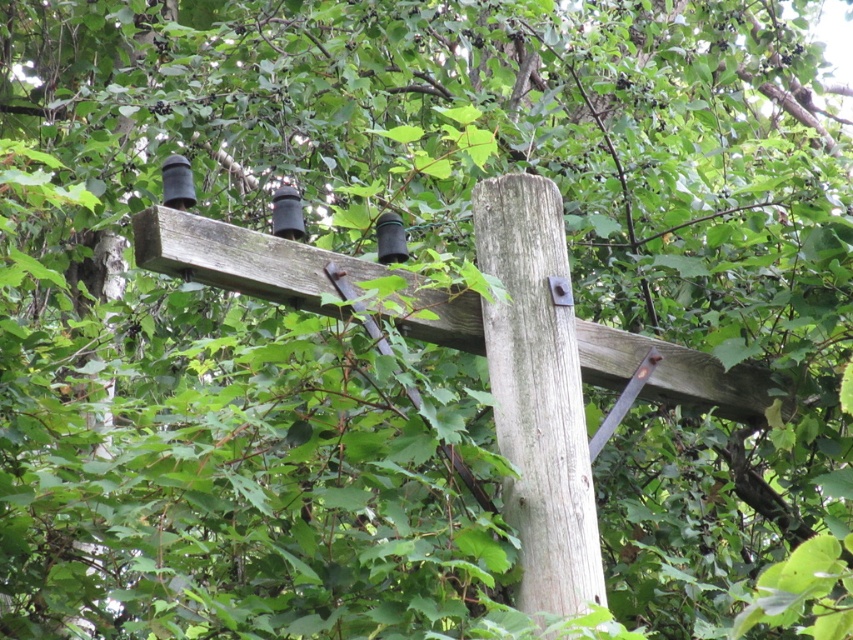
You are a painter standing at the base of the gray wood telegraph pole at center and the weathered wood beam at center. You need to paint both objects. Which object should you paint first if you want to start with the taller one?

The gray wood telegraph pole at center is taller than the weathered wood beam at center, so you should paint the gray wood telegraph pole at center first.

You are a painter needing to assess the space required to paint the gray wood telegraph pole at center and the weathered wood beam at center. Which object will require less area to paint?

The gray wood telegraph pole at center occupies less space than the weathered wood beam at center, so it will require less area to paint.

You are an electrician inspecting the wooden utility pole and its components. You need to determine the spatial relationship between the gray wood telegraph pole at center and the weathered wood beam at center. Based on the scene, which object is located above the other?

The gray wood telegraph pole at center is positioned under the weathered wood beam at center, meaning the weathered wood beam at center is above the gray wood telegraph pole at center.